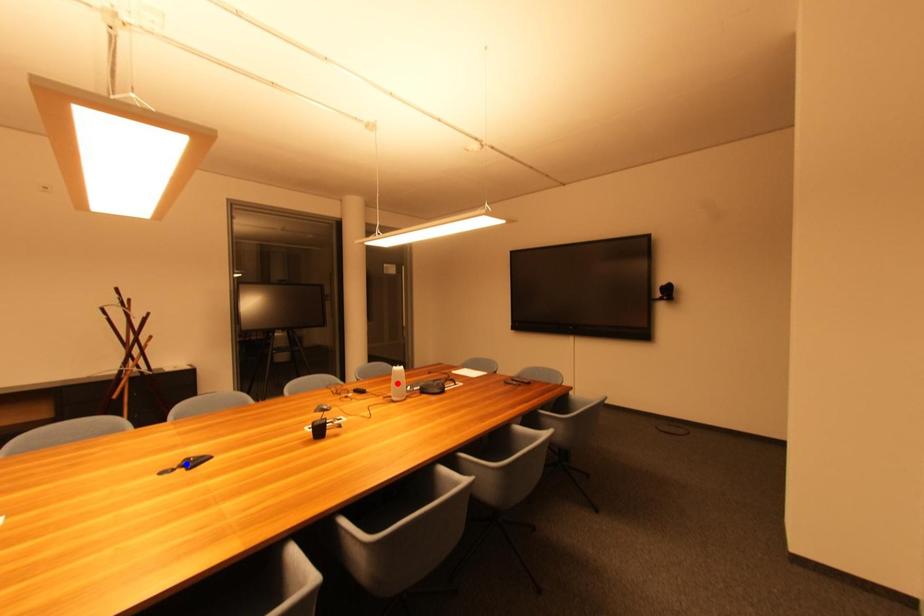
Question: Which of the two points in the image is closer to the camera?

Choices:
 (A) Blue point is closer.
 (B) Red point is closer.

Answer: (A)